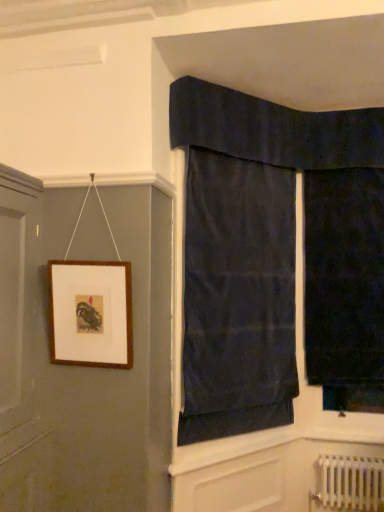
Question: Is white metallic radiator at lower right taller or shorter than dark blue fabric at upper center, the 1th curtain from the left?

Choices:
 (A) tall
 (B) short

Answer: (B)

Question: Is white metallic radiator at lower right situated inside dark blue fabric at upper center, marked as the 2th curtain in a right-to-left arrangement, or outside?

Choices:
 (A) inside
 (B) outside

Answer: (B)

Question: Considering the real-world distances, which object is farthest from the brown wooden picture frame at upper left?

Choices:
 (A) dark velvet curtain at right, the second curtain in the left-to-right sequence
 (B) dark blue fabric at upper center, the 1th curtain from the left
 (C) white metallic radiator at lower right

Answer: (C)

Question: Considering the real-world distances, which object is farthest from the dark velvet curtain at right, the second curtain in the left-to-right sequence?

Choices:
 (A) white metallic radiator at lower right
 (B) dark blue fabric at upper center, marked as the 2th curtain in a right-to-left arrangement
 (C) brown wooden picture frame at upper left

Answer: (C)